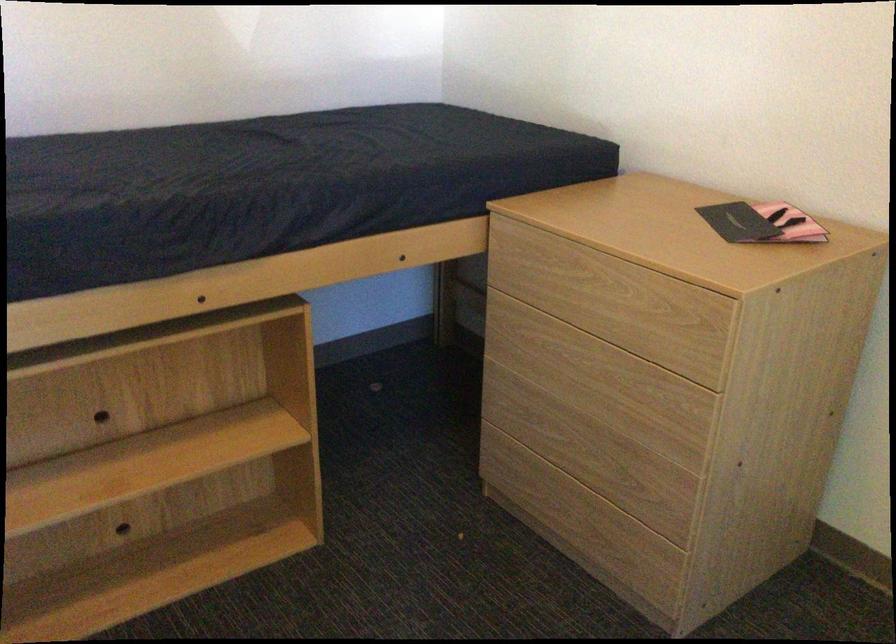
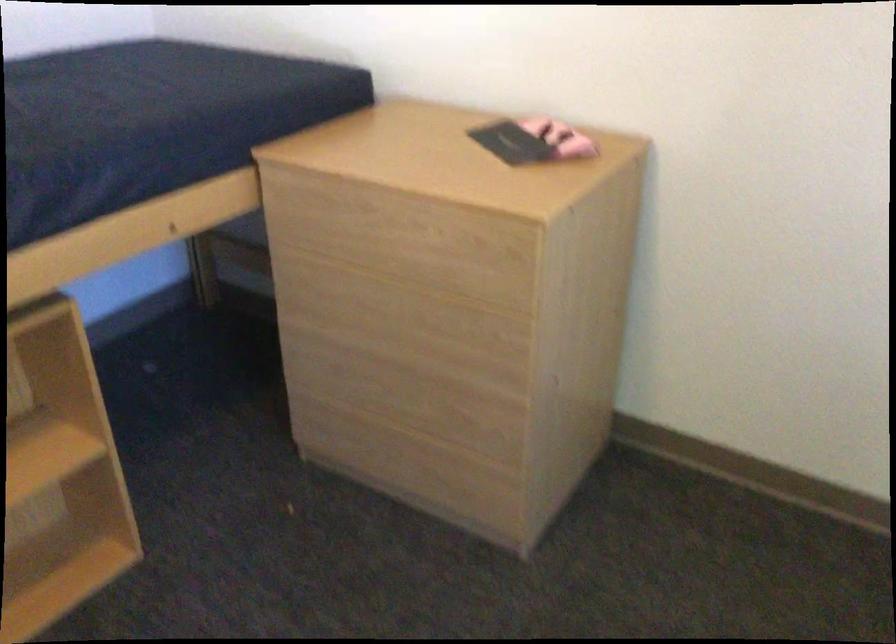
Question: The first image is from the beginning of the video and the second image is from the end. How did the camera likely rotate when shooting the video?

Choices:
 (A) Left
 (B) Right
 (C) Up
 (D) Down

Answer: (B)